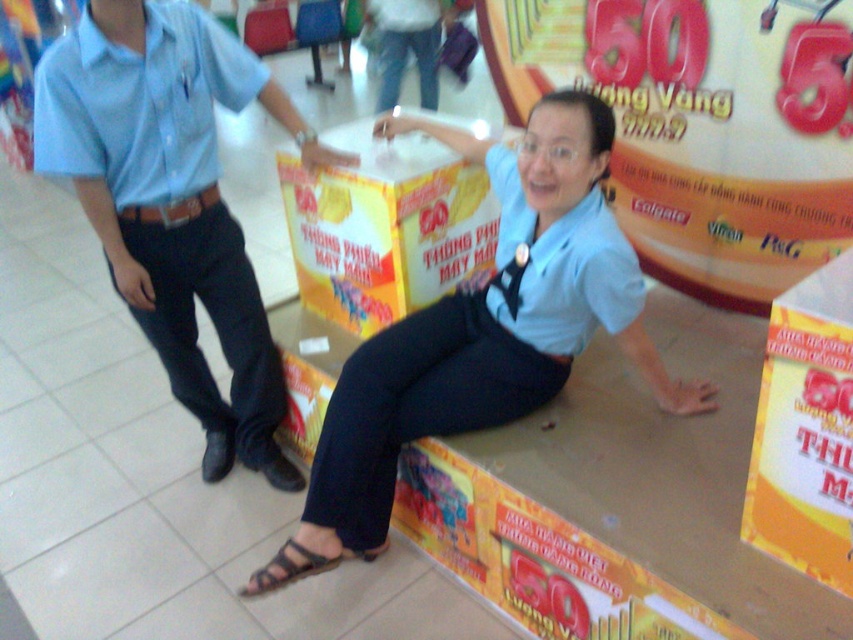
Question: Is light blue shirt at center to the left of yellow cardboard box at center from the viewer's perspective?

Choices:
 (A) no
 (B) yes

Answer: (A)

Question: Which object is the closest to the light blue shirt at left?

Choices:
 (A) light blue shirt at center
 (B) light blue cotton shirt at left

Answer: (B)

Question: Which is nearer to the light blue cotton shirt at left?

Choices:
 (A) light blue shirt at left
 (B) black leather sandal at lower center

Answer: (A)

Question: Is light blue cotton shirt at left to the right of black leather sandal at lower center from the viewer's perspective?

Choices:
 (A) yes
 (B) no

Answer: (B)

Question: Based on their relative distances, which object is farther from the light blue shirt at left?

Choices:
 (A) black leather sandal at lower center
 (B) light blue shirt at center
 (C) light blue cotton shirt at left
 (D) light blue fabric shirt at center

Answer: (A)

Question: Does light blue cotton shirt at left have a lesser width compared to black leather sandal at lower center?

Choices:
 (A) no
 (B) yes

Answer: (A)